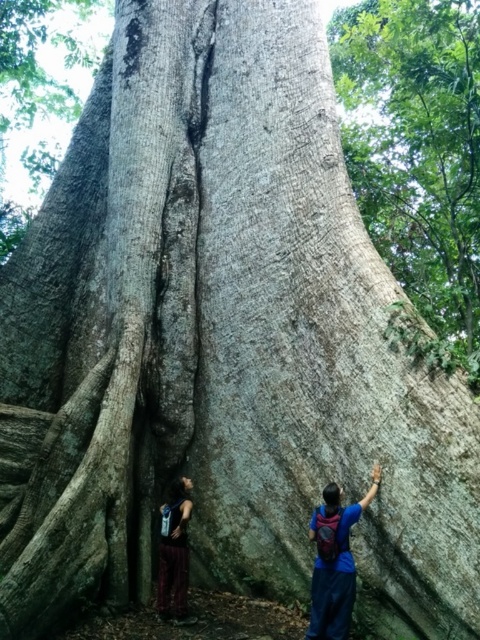
Can you confirm if rough bark tree at upper right is thinner than blue fabric backpack at right?

Incorrect, rough bark tree at upper right's width is not less than blue fabric backpack at right's.

Does rough bark tree at upper right have a smaller size compared to blue fabric backpack at right?

No, rough bark tree at upper right is not smaller than blue fabric backpack at right.

Locate an element on the screen. This screenshot has height=640, width=480. rough bark tree at upper right is located at coordinates (419, 150).

Image resolution: width=480 pixels, height=640 pixels. I want to click on rough bark tree at upper right, so click(x=419, y=150).

Which is behind, point (344, 586) or point (184, 579)?

The point (184, 579) is behind.

Can you confirm if blue fabric backpack at right is positioned below dark brown leather pants at lower left?

Incorrect, blue fabric backpack at right is not positioned below dark brown leather pants at lower left.

Image resolution: width=480 pixels, height=640 pixels. Describe the element at coordinates (336, 564) in the screenshot. I see `blue fabric backpack at right` at that location.

Identify the location of blue fabric backpack at right. This screenshot has height=640, width=480. (336, 564).

Does rough bark tree at upper right appear on the right side of dark brown leather pants at lower left?

Indeed, rough bark tree at upper right is positioned on the right side of dark brown leather pants at lower left.

Can you confirm if rough bark tree at upper right is positioned above dark brown leather pants at lower left?

Indeed, rough bark tree at upper right is positioned over dark brown leather pants at lower left.

Who is more forward, (372, 10) or (167, 502)?

Point (167, 502)

Locate an element on the screen. The height and width of the screenshot is (640, 480). rough bark tree at upper right is located at coordinates (419, 150).